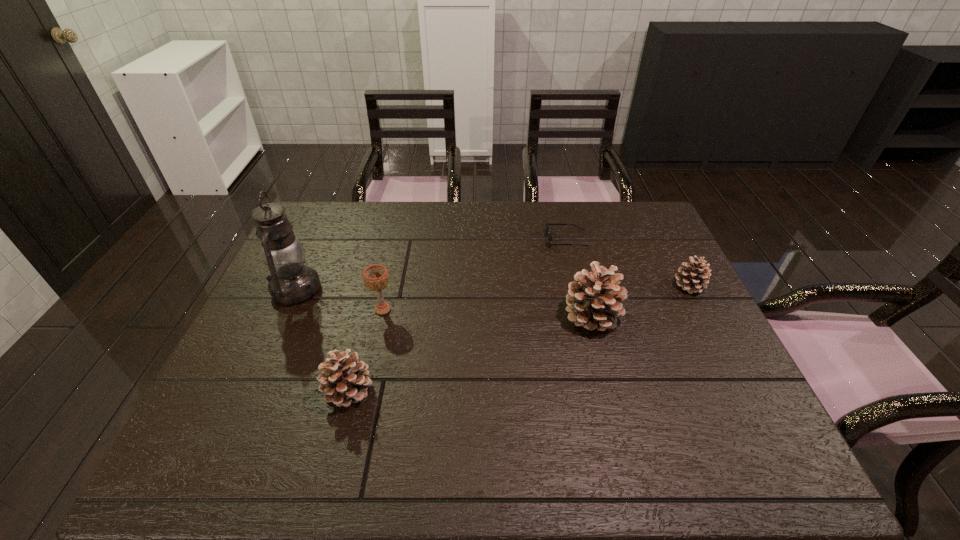
At what (x,y) coordinates should I click in order to perform the action: click on object that is positioned at the near edge. Please return your answer as a coordinate pair (x, y). This screenshot has width=960, height=540. Looking at the image, I should click on (344, 380).

Find the location of a particular element. This screenshot has width=960, height=540. object present at the left edge is located at coordinates (291, 282).

Where is `object at the right edge`? This screenshot has height=540, width=960. object at the right edge is located at coordinates (694, 278).

Locate an element on the screen. vacant area at the far edge of the desktop is located at coordinates (374, 205).

Where is `vacant area at the near edge of the desktop`? This screenshot has width=960, height=540. vacant area at the near edge of the desktop is located at coordinates (399, 422).

Locate an element on the screen. vacant space at the left edge of the desktop is located at coordinates (314, 310).

At what (x,y) coordinates should I click in order to perform the action: click on free space at the right edge of the desktop. Please return your answer as a coordinate pair (x, y). The height and width of the screenshot is (540, 960). Looking at the image, I should click on (709, 320).

Where is `free space at the far left corner of the desktop`? The image size is (960, 540). free space at the far left corner of the desktop is located at coordinates (337, 238).

Find the location of a particular element. blank area at the near left corner is located at coordinates (204, 420).

This screenshot has height=540, width=960. Identify the location of vacant region at the far right corner of the desktop. (632, 213).